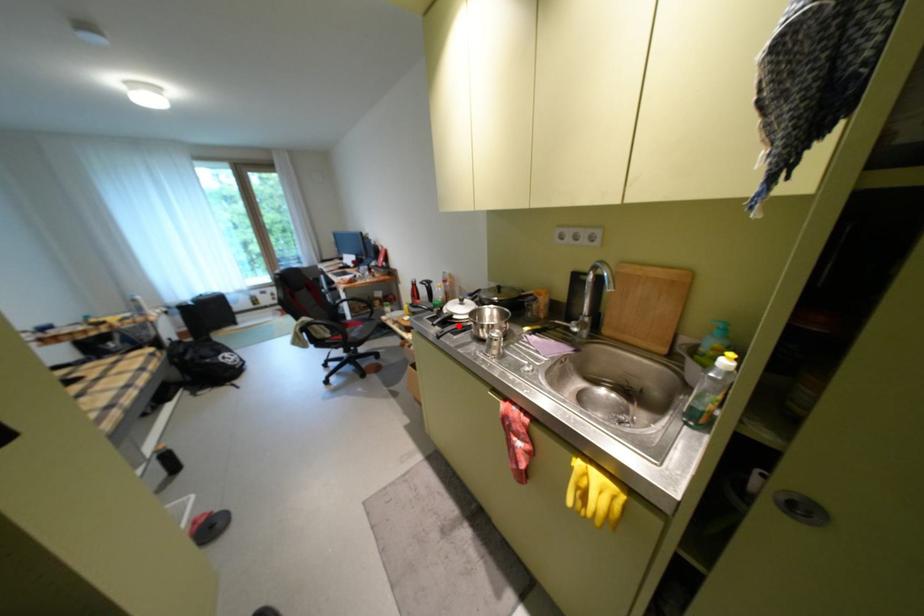
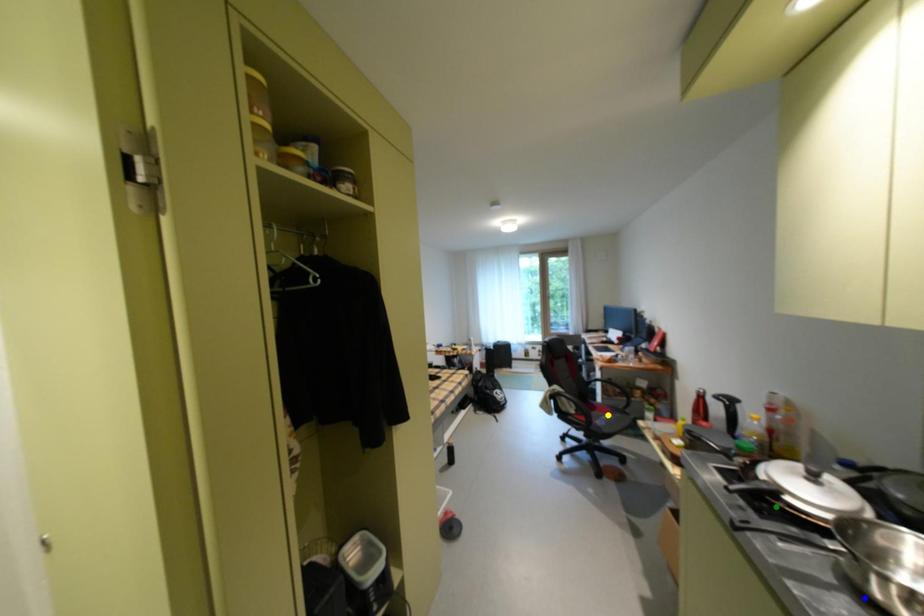
Question: I am providing you with two images of the same scene from different viewpoints. A red point is marked on the first image. You are given multiple points on the second image. In image 2, which mark is for the same physical point as the one in image 1?

Choices:
 (A) yellow point
 (B) green point
 (C) blue point

Answer: (B)